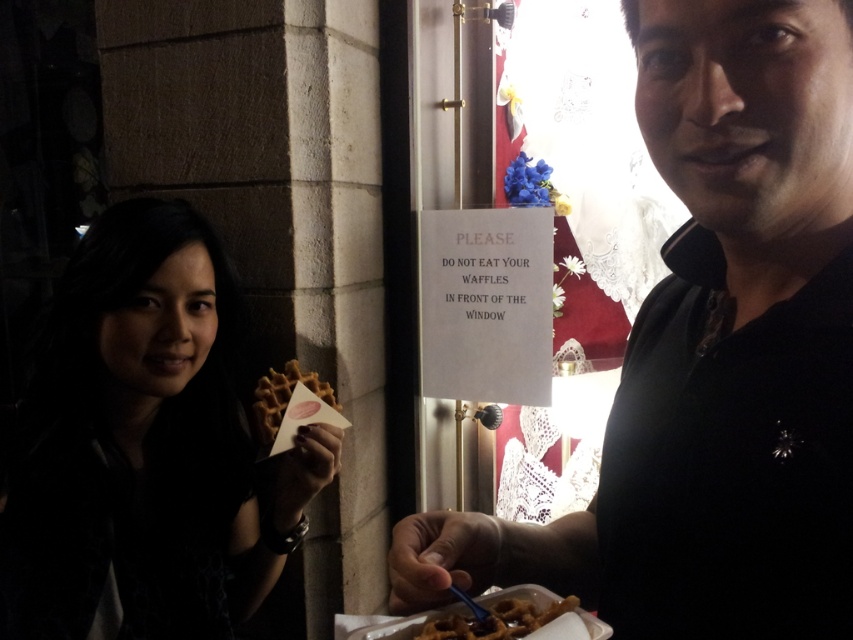
You are a photographer setting up a shot at the cafe. You need to ensure that both the black matte shirt at center and the golden brown waffle at center are in focus. The camera can only focus on objects within a 25 inch range. Can both objects be in focus?

The black matte shirt at center and golden brown waffle at center are 28.69 inches apart, which exceeds the camera focus range of 25 inches. Therefore, both objects cannot be in focus simultaneously.

You are a photographer trying to capture a clear shot of the golden brown waffle at center without the black matte shirt at center blocking it. What adjustment should you make to your camera angle?

The black matte shirt at center is positioned over the golden brown waffle at center, so you should lower your camera angle to avoid the shirt blocking the waffle.

You are a photographer setting up a shot for a food advertisement. You need to ensure that the black matte shirt at center and the matte brown waffle at left are both visible in the frame. Given their heights, which object should you adjust to avoid being cut off?

The black matte shirt at center is shorter than the matte brown waffle at left, so you should adjust the matte brown waffle at left to lower it or the black matte shirt at center to raise it to ensure both are fully visible in the frame.